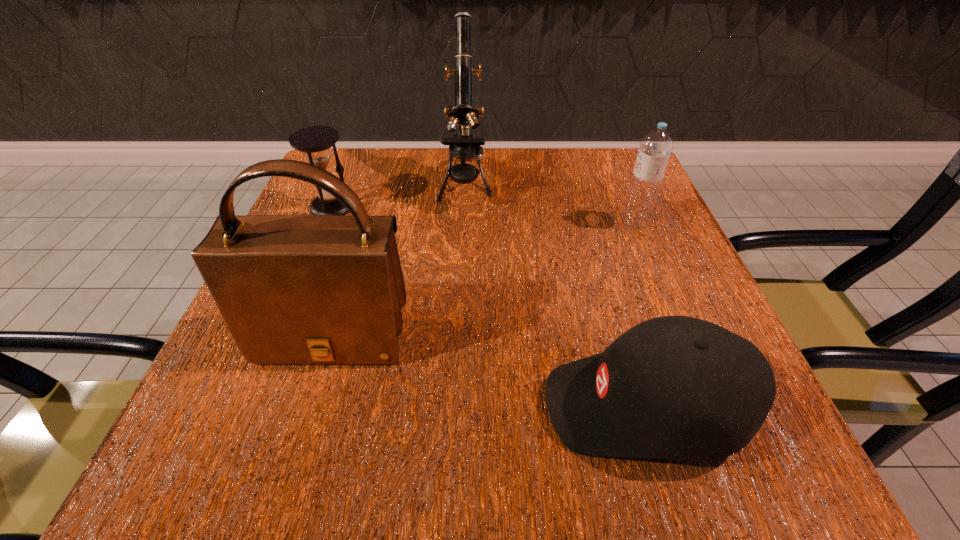
Locate an element on the screen. The width and height of the screenshot is (960, 540). the third object from right to left is located at coordinates (464, 146).

Image resolution: width=960 pixels, height=540 pixels. I want to click on shoulder bag, so click(292, 289).

At what (x,y) coordinates should I click in order to perform the action: click on water bottle. Please return your answer as a coordinate pair (x, y). This screenshot has height=540, width=960. Looking at the image, I should click on (655, 148).

You are a GUI agent. You are given a task and a screenshot of the screen. Output one action in this format:
    pyautogui.click(x=<x>, y=<y>)
    Task: Click on the hourglass
    Image resolution: width=960 pixels, height=540 pixels.
    Given the screenshot: What is the action you would take?
    pyautogui.click(x=316, y=141)

Identify the location of baseball cap. (674, 387).

I want to click on vacant space located 0.110m through the eyepiece of the third object from left to right, so click(x=463, y=252).

Identify the location of blank space located 0.130m on the front flap of the shoulder bag. This screenshot has width=960, height=540. (295, 463).

Find the location of a particular element. The image size is (960, 540). free point located on the front of the third tallest object is located at coordinates (714, 414).

Where is `vacant space located on the right of the hourglass`? This screenshot has width=960, height=540. vacant space located on the right of the hourglass is located at coordinates (508, 206).

The image size is (960, 540). What are the coordinates of `free space located 0.110m with a logo on the front of the shortest object` in the screenshot? It's located at (460, 406).